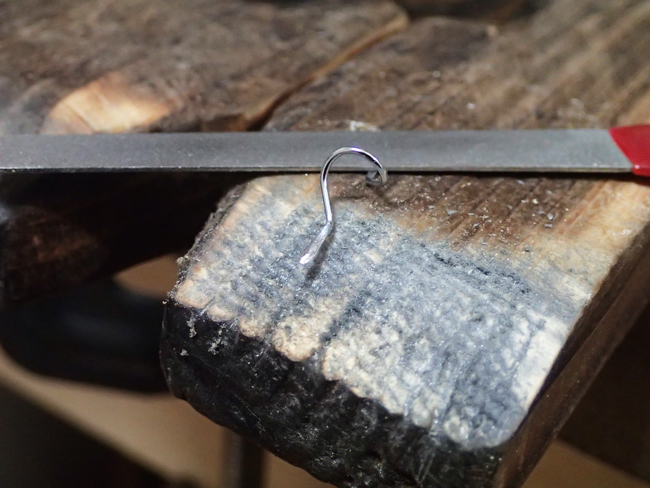
Where is `floor`? floor is located at coordinates (162, 434).